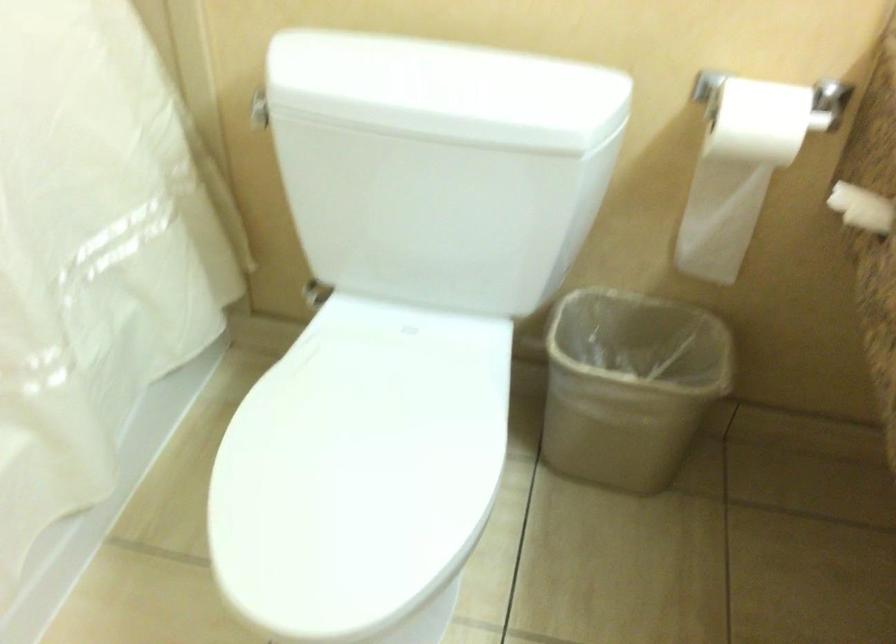
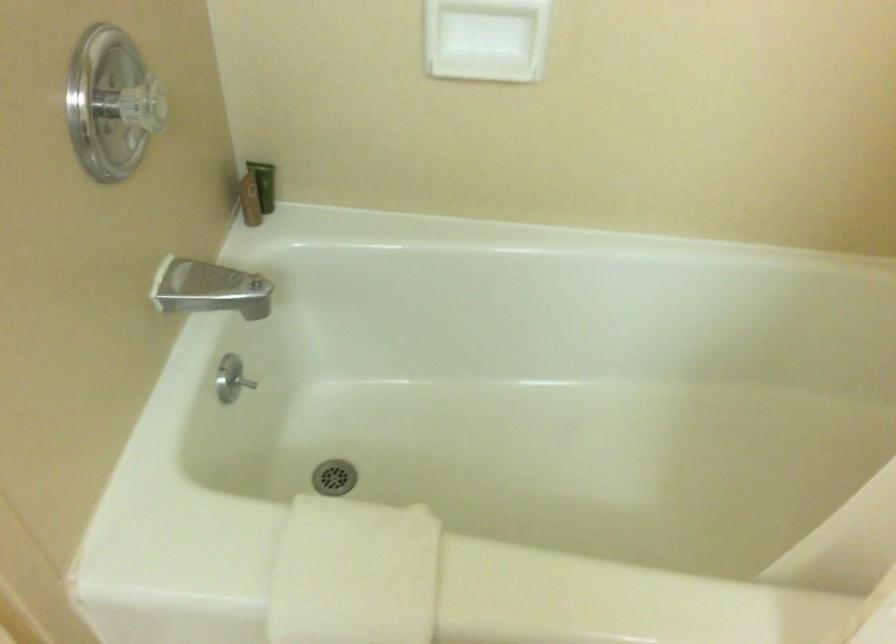
First-person continuous shooting, in which direction is the camera rotating?

The camera's rotation is toward left-down.